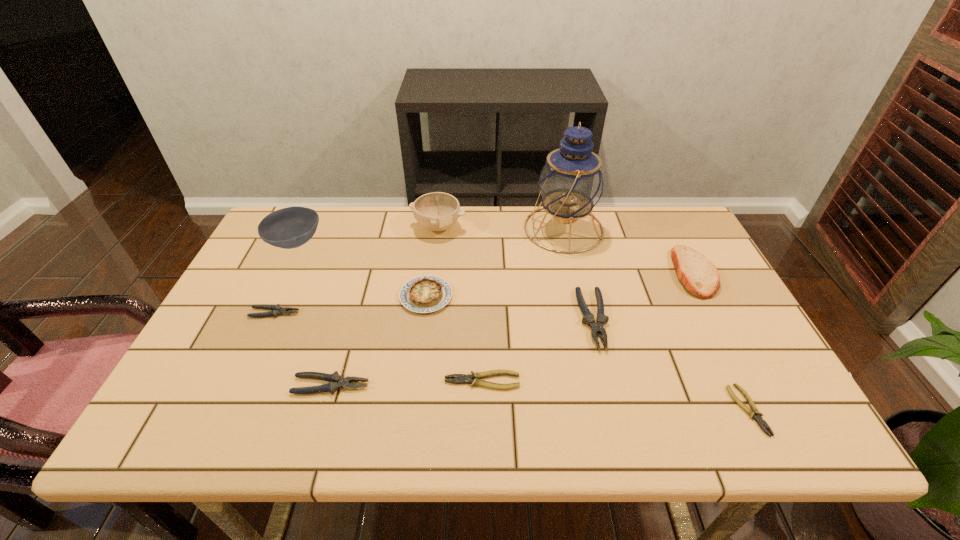
Locate an element on the screen. The height and width of the screenshot is (540, 960). the third shortest pliers is located at coordinates (277, 310).

I want to click on the third shortest object, so click(x=277, y=310).

This screenshot has height=540, width=960. What are the coordinates of `the fourth tallest pliers` in the screenshot? It's located at (474, 378).

Where is `the left yellow pliers`? the left yellow pliers is located at coordinates (474, 378).

This screenshot has height=540, width=960. I want to click on the smaller yellow pliers, so coord(754,413).

The height and width of the screenshot is (540, 960). What are the coordinates of `the right yellow pliers` in the screenshot? It's located at (754, 413).

Where is `free location located on the front-facing side of the lantern`? The width and height of the screenshot is (960, 540). free location located on the front-facing side of the lantern is located at coordinates (405, 229).

At what (x,y) coordinates should I click in order to perform the action: click on vacant space situated on the front-facing side of the lantern. Please return your answer as a coordinate pair (x, y). The width and height of the screenshot is (960, 540). Looking at the image, I should click on (473, 229).

Identify the location of free space located 0.310m on the front-facing side of the lantern. (426, 229).

You are a GUI agent. You are given a task and a screenshot of the screen. Output one action in this format:
    pyautogui.click(x=<x>, y=<y>)
    Task: Click on the free space located 0.100m on the left of the beige bowl
    
    Given the screenshot: What is the action you would take?
    pyautogui.click(x=379, y=227)